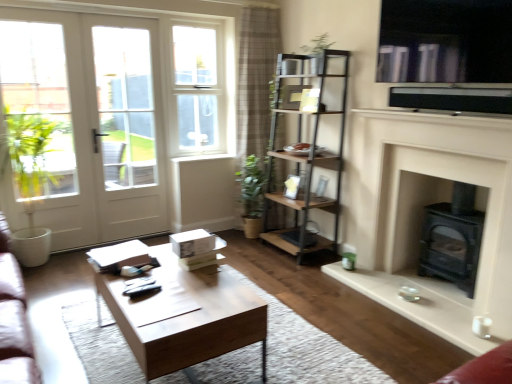
Where is `free spot to the right of wooden coffee table at center`? The width and height of the screenshot is (512, 384). free spot to the right of wooden coffee table at center is located at coordinates (295, 350).